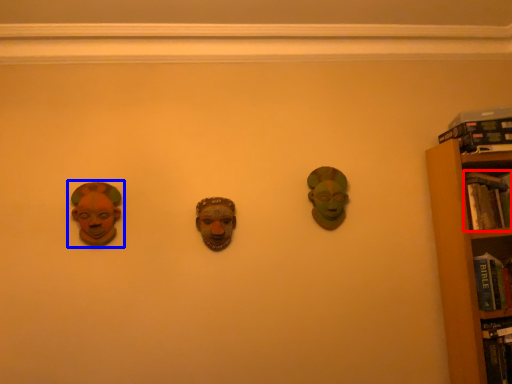
Question: Which point is closer to the camera, book (highlighted by a red box) or head (highlighted by a blue box)?

Choices:
 (A) book
 (B) head

Answer: (B)